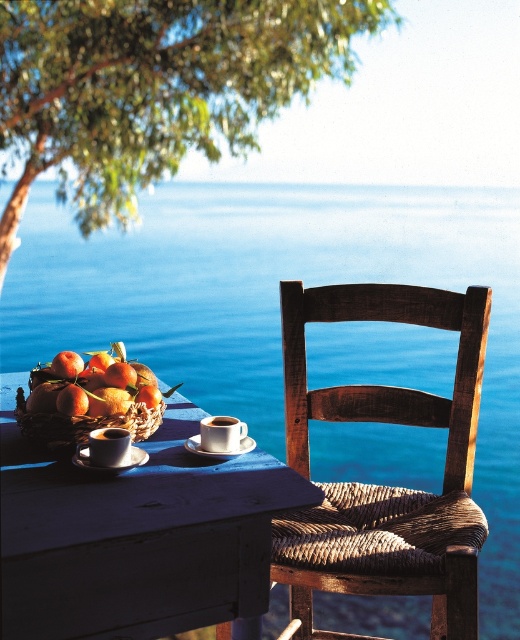
You are setting up a picnic and have a small basket that can only accommodate one item. You need to choose between the shiny golden apples at left and the matte ceramic mug at center. Which item can fit into the basket if the basket is narrower than the wider of the two items?

The basket is narrower than the wider of the two items, which is the shiny golden apples at left. Therefore, neither item will fit into the basket.